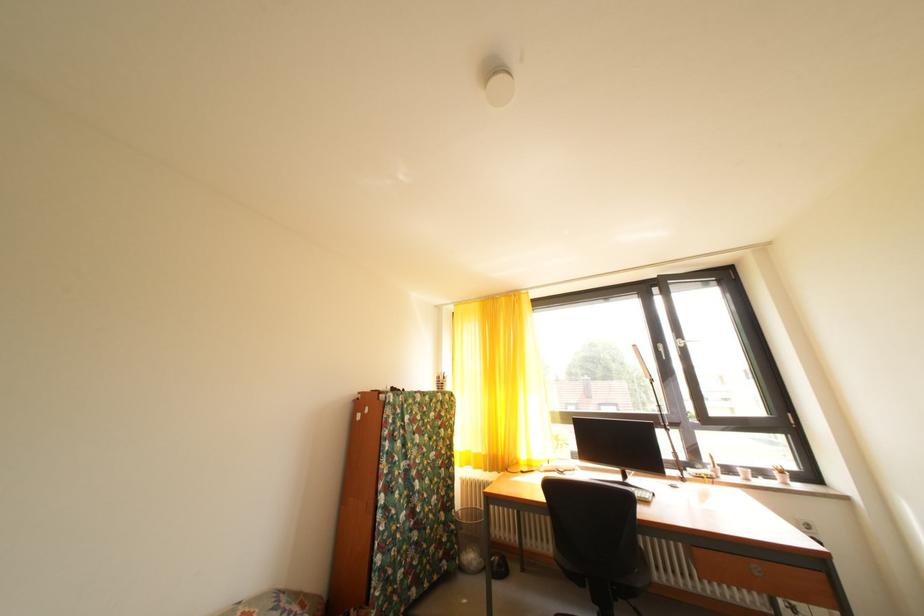
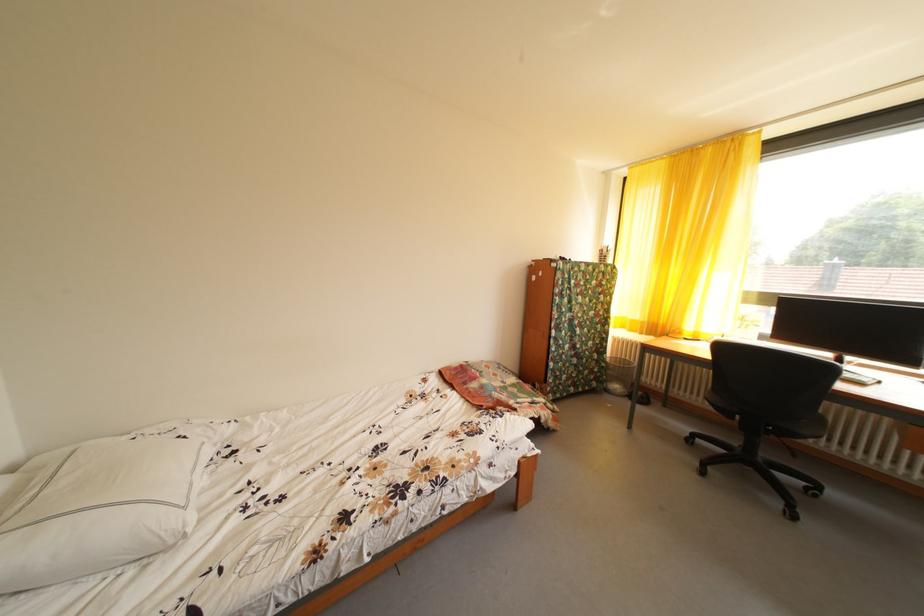
How did the camera likely rotate?

The rotation direction of the camera is left-down.